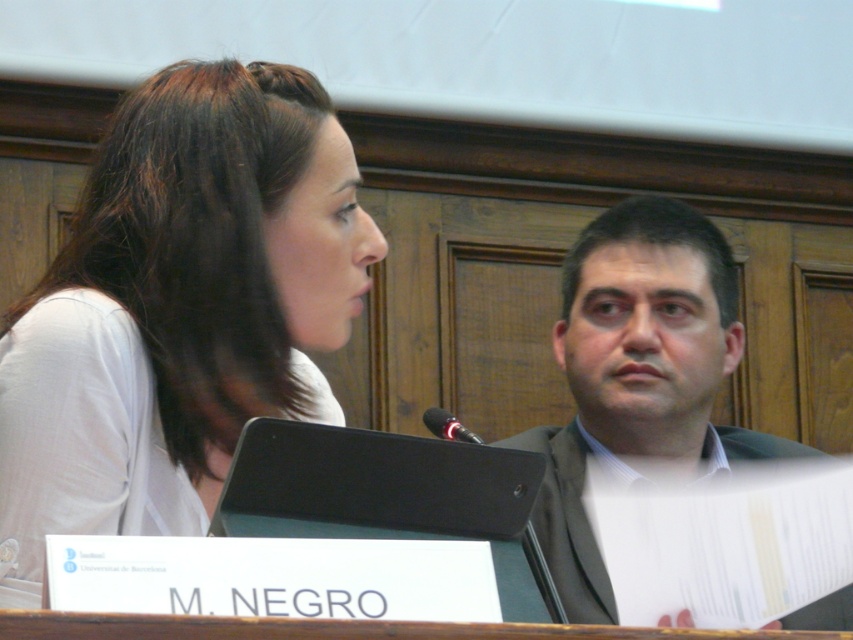
You are attending a formal event and need to determine seating arrangements based on the image provided. Which object, the white matte shirt at upper left or the dark gray suit at right, should be seated closer to the front row if the seating is based on height?

The white matte shirt at upper left is not as tall as the dark gray suit at right, so the dark gray suit at right should be seated closer to the front row since taller individuals typically occupy front rows at formal events.

You are a photographer at the event and need to focus your camera on the white matte shirt at upper left. What are the coordinates where you should aim your camera?

The coordinates for the white matte shirt at upper left are at point [178,308].